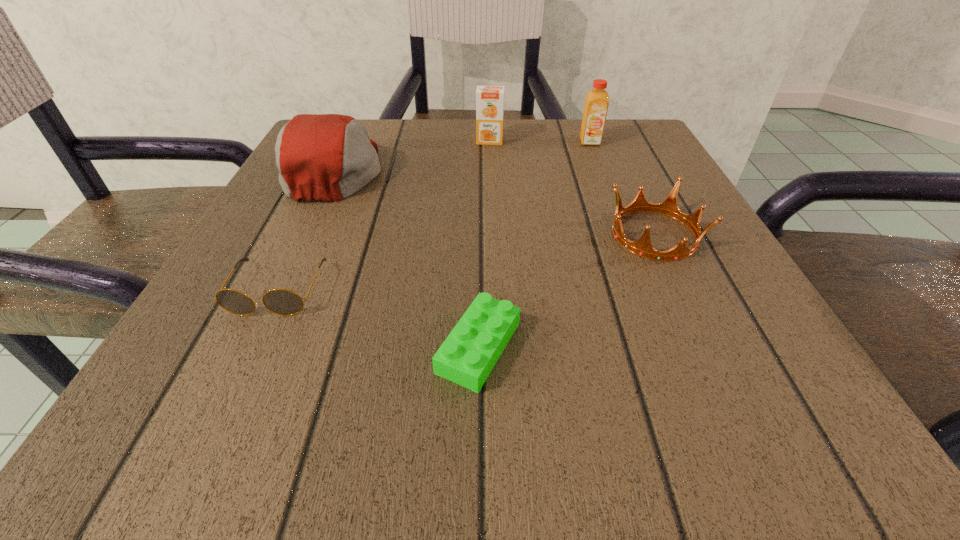
The width and height of the screenshot is (960, 540). Find the location of `vacant point located between the right orange juice and the third shortest object`. vacant point located between the right orange juice and the third shortest object is located at coordinates (622, 188).

Locate an element on the screen. The image size is (960, 540). free spot between the right orange juice and the cap is located at coordinates (463, 156).

Locate an element on the screen. The width and height of the screenshot is (960, 540). free point between the shortest object and the second shortest object is located at coordinates (378, 319).

At what (x,y) coordinates should I click in order to perform the action: click on vacant area between the second shortest object and the cap. Please return your answer as a coordinate pair (x, y). This screenshot has height=540, width=960. Looking at the image, I should click on (306, 230).

Where is `blank region between the Lego and the cap`? Image resolution: width=960 pixels, height=540 pixels. blank region between the Lego and the cap is located at coordinates (407, 259).

Where is `free space that is in between the left orange juice and the Lego`? free space that is in between the left orange juice and the Lego is located at coordinates (484, 244).

Locate an element on the screen. vacant area that lies between the cap and the shortest object is located at coordinates (407, 259).

The image size is (960, 540). I want to click on vacant space that is in between the Lego and the sunglasses, so click(x=378, y=319).

Locate which object is the third closest to the second shortest object. Please provide its 2D coordinates. Your answer should be formatted as a tuple, i.e. [(x, y)], where the tuple contains the x and y coordinates of a point satisfying the conditions above.

[(669, 207)]

Identify which object is the fourth closest to the cap. Please provide its 2D coordinates. Your answer should be formatted as a tuple, i.e. [(x, y)], where the tuple contains the x and y coordinates of a point satisfying the conditions above.

[(669, 207)]